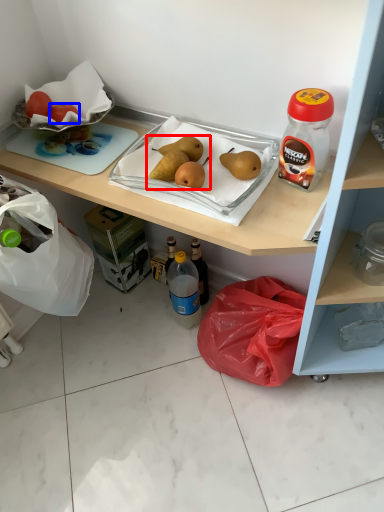
Question: Which object appears closest to the camera in this image, food (highlighted by a red box) or fruit (highlighted by a blue box)?

Choices:
 (A) food
 (B) fruit

Answer: (A)